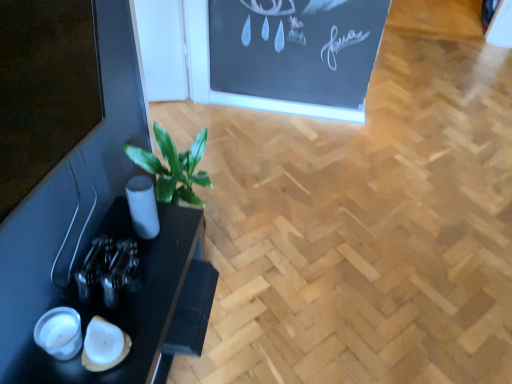
Locate an element on the screen. This screenshot has height=384, width=512. unoccupied space behind metallic glass bottle at left is located at coordinates (133, 226).